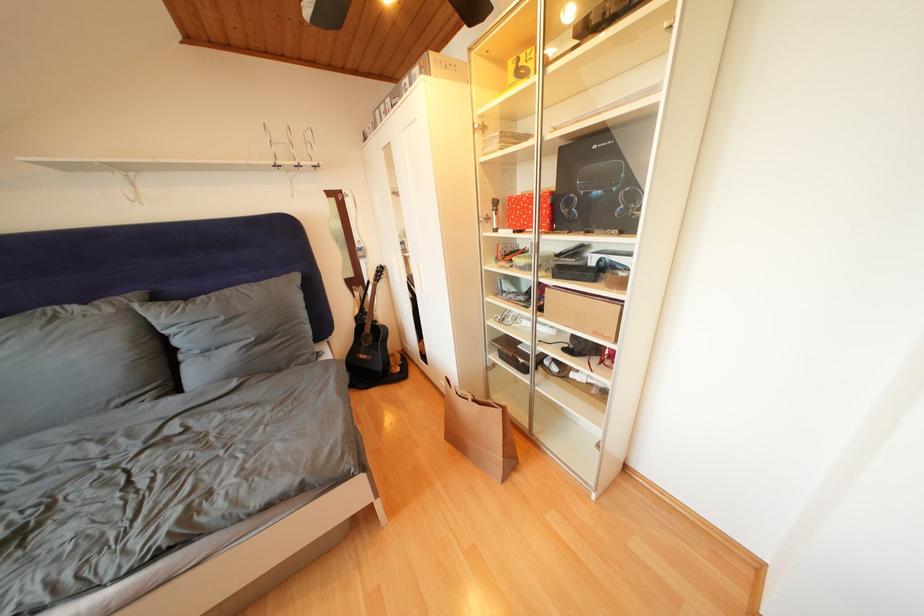
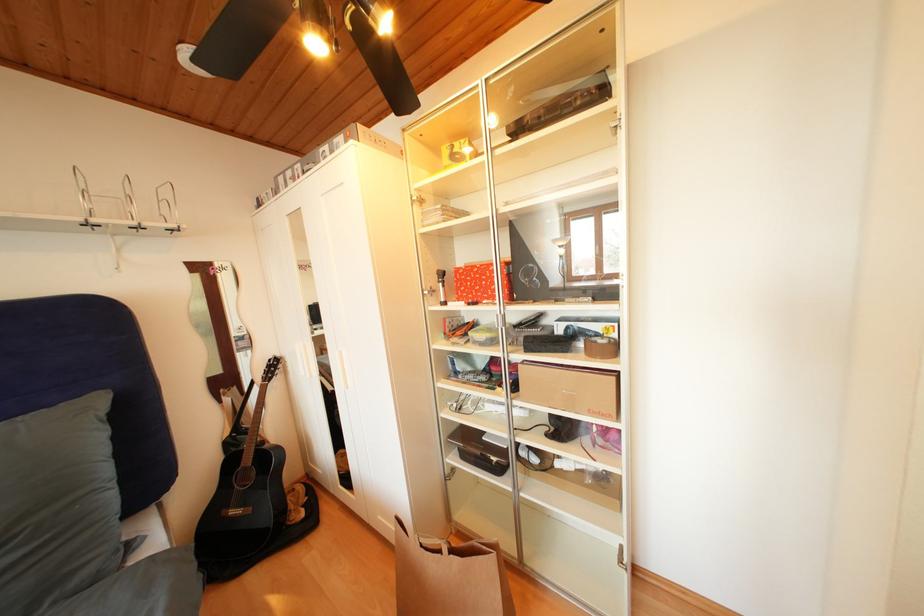
Question: The camera is either moving clockwise (left) or counter-clockwise (right) around the object. The first image is from the beginning of the video and the second image is from the end. Is the camera moving left or right when shooting the video?

Choices:
 (A) Left
 (B) Right

Answer: (A)